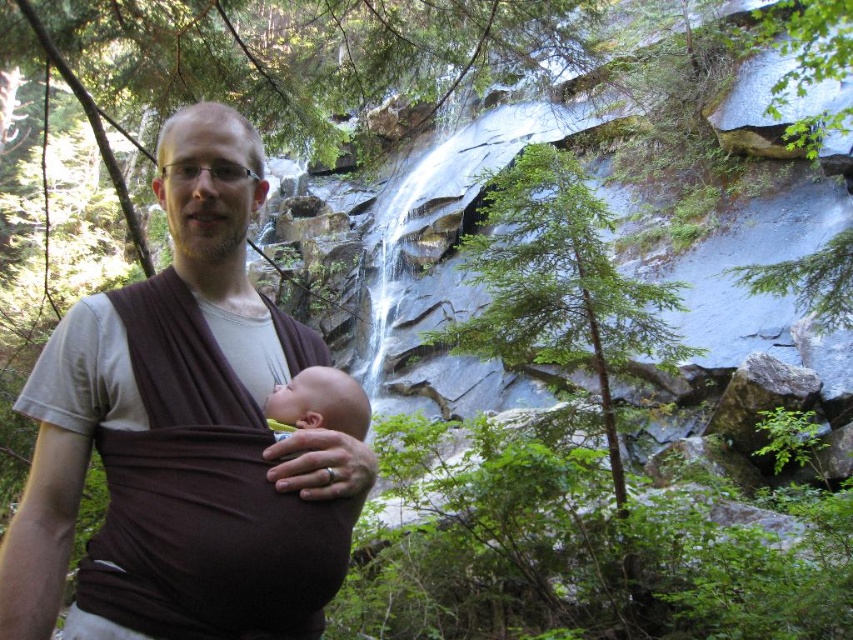
Question: Is brown fabric baby carrier at center behind smooth brown baby at center?

Choices:
 (A) yes
 (B) no

Answer: (B)

Question: Among these points, which one is farthest from the camera?

Choices:
 (A) (361, 440)
 (B) (206, 545)

Answer: (A)

Question: Does brown fabric baby carrier at center lie in front of smooth brown baby at center?

Choices:
 (A) no
 (B) yes

Answer: (B)

Question: Does brown fabric baby carrier at center appear over smooth brown baby at center?

Choices:
 (A) no
 (B) yes

Answer: (A)